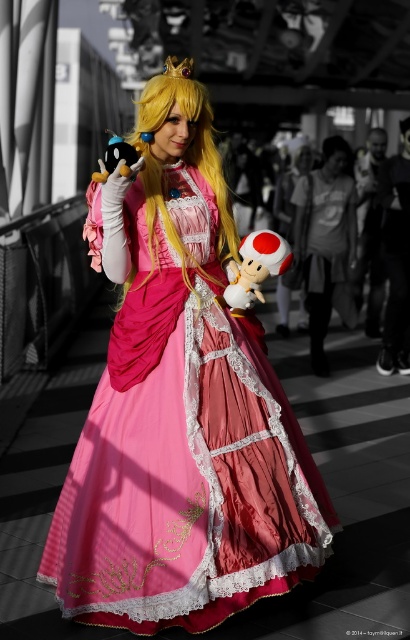
You are taking a photo of the Princess Peach costume. You notice two points on the costume, one at point (150,84) and another at point (264,278). Which point is nearer to your camera?

Point (150,84) is closer to the camera than point (264,278).

You need to locate the matte pink dress at center in the image. What are its coordinates?

The matte pink dress at center is located at coordinates point (x=179, y=406).